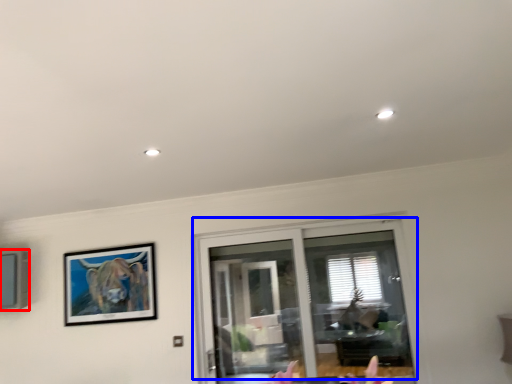
Question: Which object appears closest to the camera in this image, picture frame (highlighted by a red box) or window (highlighted by a blue box)?

Choices:
 (A) picture frame
 (B) window

Answer: (B)